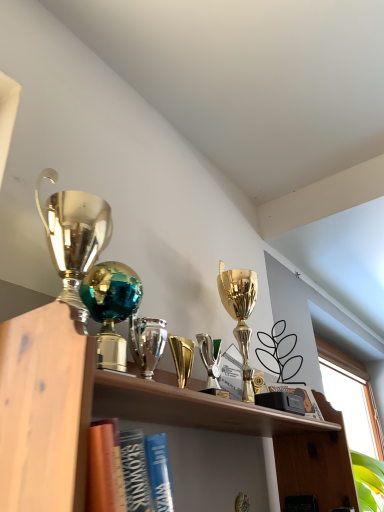
At what (x,y) coordinates should I click in order to perform the action: click on shiny silver trophy at center, which ranks as the first trophy in right-to-left order. Please return your answer as a coordinate pair (x, y). This screenshot has height=512, width=384. Looking at the image, I should click on (147, 342).

Describe the element at coordinates (111, 308) in the screenshot. I see `shiny teal glass globe at center, which is counted as the 2th trophy, starting from the right` at that location.

Where is `black matte book at center`? The width and height of the screenshot is (384, 512). black matte book at center is located at coordinates (300, 396).

Is black matte book at center oriented towards shiny silver trophy at center, the 2th trophy positioned from the left?

No, black matte book at center does not turn towards shiny silver trophy at center, the 2th trophy positioned from the left.

From a real-world perspective, is black matte book at center under shiny silver trophy at center, which ranks as the first trophy in right-to-left order?

Yes.

Between black matte book at center and shiny silver trophy at center, which ranks as the first trophy in right-to-left order, which one has smaller width?

shiny silver trophy at center, which ranks as the first trophy in right-to-left order.

From the picture: Considering the relative sizes of shiny teal glass globe at center, the 1th trophy viewed from the left, and black matte book at center in the image provided, is shiny teal glass globe at center, the 1th trophy viewed from the left, shorter than black matte book at center?

In fact, shiny teal glass globe at center, the 1th trophy viewed from the left, may be taller than black matte book at center.

Does point (99, 337) come behind point (273, 390)?

No, (99, 337) is in front of (273, 390).

From a real-world perspective, does shiny teal glass globe at center, the 1th trophy viewed from the left, sit lower than black matte book at center?

No.

Is point (135, 317) less distant than point (106, 275)?

No, (135, 317) is behind (106, 275).

Consider the image. From the image's perspective, is shiny silver trophy at center, which ranks as the first trophy in right-to-left order, over shiny teal glass globe at center, which is counted as the 2th trophy, starting from the right?

No, from the image's perspective, shiny silver trophy at center, which ranks as the first trophy in right-to-left order, is not over shiny teal glass globe at center, which is counted as the 2th trophy, starting from the right.

What's the angular difference between shiny silver trophy at center, which ranks as the first trophy in right-to-left order, and shiny teal glass globe at center, the 1th trophy viewed from the left,'s facing directions?

3.1 degrees.

Can we say shiny silver trophy at center, the 2th trophy positioned from the left, lies outside shiny teal glass globe at center, which is counted as the 2th trophy, starting from the right?

Absolutely, shiny silver trophy at center, the 2th trophy positioned from the left, is external to shiny teal glass globe at center, which is counted as the 2th trophy, starting from the right.

Starting from the black matte book at center, which trophy is the 1st one in front? Please provide its 2D coordinates.

[(147, 342)]

Consider the image. Considering the positions of objects shiny silver trophy at center, the 2th trophy positioned from the left, and black matte book at center in the image provided, who is more to the left, shiny silver trophy at center, the 2th trophy positioned from the left, or black matte book at center?

shiny silver trophy at center, the 2th trophy positioned from the left, is more to the left.

Is shiny silver trophy at center, which ranks as the first trophy in right-to-left order, bigger or smaller than black matte book at center?

Considering their sizes, shiny silver trophy at center, which ranks as the first trophy in right-to-left order, takes up less space than black matte book at center.

Is shiny silver trophy at center, which ranks as the first trophy in right-to-left order, turned away from black matte book at center?

No, shiny silver trophy at center, which ranks as the first trophy in right-to-left order,'s orientation is not away from black matte book at center.

Does shiny teal glass globe at center, which is counted as the 2th trophy, starting from the right, have a smaller size compared to shiny silver trophy at center, the 2th trophy positioned from the left?

Incorrect, shiny teal glass globe at center, which is counted as the 2th trophy, starting from the right, is not smaller in size than shiny silver trophy at center, the 2th trophy positioned from the left.

Between point (96, 315) and point (151, 319), which one is positioned in front?

Point (96, 315)

From a real-world perspective, is shiny teal glass globe at center, the 1th trophy viewed from the left, beneath shiny silver trophy at center, the 2th trophy positioned from the left?

No, from a real-world perspective, shiny teal glass globe at center, the 1th trophy viewed from the left, is not beneath shiny silver trophy at center, the 2th trophy positioned from the left.

The height and width of the screenshot is (512, 384). Find the location of `trophy directly beneath the shiny teal glass globe at center, the 1th trophy viewed from the left (from a real-world perspective)`. trophy directly beneath the shiny teal glass globe at center, the 1th trophy viewed from the left (from a real-world perspective) is located at coordinates (147, 342).

Could shiny teal glass globe at center, the 1th trophy viewed from the left, be considered to be inside black matte book at center?

Definitely not — shiny teal glass globe at center, the 1th trophy viewed from the left, is not inside black matte book at center.

Does black matte book at center have a lesser width compared to shiny teal glass globe at center, which is counted as the 2th trophy, starting from the right?

Correct, the width of black matte book at center is less than that of shiny teal glass globe at center, which is counted as the 2th trophy, starting from the right.

Is black matte book at center in contact with shiny teal glass globe at center, the 1th trophy viewed from the left?

No, black matte book at center is not making contact with shiny teal glass globe at center, the 1th trophy viewed from the left.

From the image's perspective, which object appears higher, black matte book at center or shiny teal glass globe at center, the 1th trophy viewed from the left?

shiny teal glass globe at center, the 1th trophy viewed from the left, from the image's perspective.

At what (x,y) coordinates should I click in order to perform the action: click on book that is below the shiny silver trophy at center, which ranks as the first trophy in right-to-left order (from the image's perspective). Please return your answer as a coordinate pair (x, y). Looking at the image, I should click on (300, 396).

There is a black matte book at center. Identify the location of the 2nd trophy above it (from a real-world perspective). The image size is (384, 512). (111, 308).

Estimate the real-world distances between objects in this image. Which object is further from black matte book at center, shiny silver trophy at center, the 2th trophy positioned from the left, or shiny teal glass globe at center, the 1th trophy viewed from the left?

Based on the image, shiny teal glass globe at center, the 1th trophy viewed from the left, appears to be further to black matte book at center.

Estimate the real-world distances between objects in this image. Which object is further from black matte book at center, shiny teal glass globe at center, the 1th trophy viewed from the left, or shiny silver trophy at center, which ranks as the first trophy in right-to-left order?

Among the two, shiny teal glass globe at center, the 1th trophy viewed from the left, is located further to black matte book at center.

Estimate the real-world distances between objects in this image. Which object is closer to shiny teal glass globe at center, which is counted as the 2th trophy, starting from the right, black matte book at center or shiny silver trophy at center, which ranks as the first trophy in right-to-left order?

shiny silver trophy at center, which ranks as the first trophy in right-to-left order, is closer to shiny teal glass globe at center, which is counted as the 2th trophy, starting from the right.

Estimate the real-world distances between objects in this image. Which object is further from shiny silver trophy at center, the 2th trophy positioned from the left, black matte book at center or shiny teal glass globe at center, the 1th trophy viewed from the left?

The object further to shiny silver trophy at center, the 2th trophy positioned from the left, is black matte book at center.

Considering their positions, is shiny silver trophy at center, the 2th trophy positioned from the left, positioned further to shiny teal glass globe at center, the 1th trophy viewed from the left, than black matte book at center?

Among the two, black matte book at center is located further to shiny teal glass globe at center, the 1th trophy viewed from the left.

Considering their positions, is shiny teal glass globe at center, the 1th trophy viewed from the left, positioned further to shiny silver trophy at center, the 2th trophy positioned from the left, than black matte book at center?

black matte book at center is positioned further to the anchor shiny silver trophy at center, the 2th trophy positioned from the left.

The image size is (384, 512). In order to click on trophy located between shiny teal glass globe at center, the 1th trophy viewed from the left, and black matte book at center in the left-right direction in this screenshot , I will do 147,342.